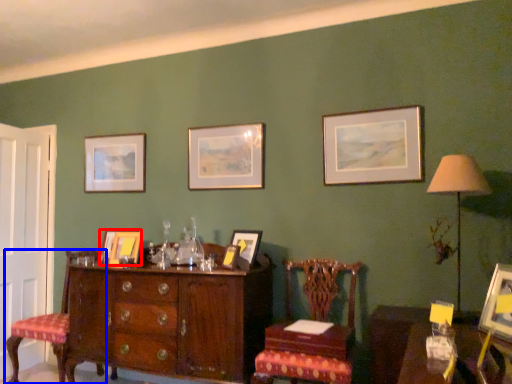
Question: Which object is further to the camera taking this photo, picture frame (highlighted by a red box) or chair (highlighted by a blue box)?

Choices:
 (A) picture frame
 (B) chair

Answer: (A)